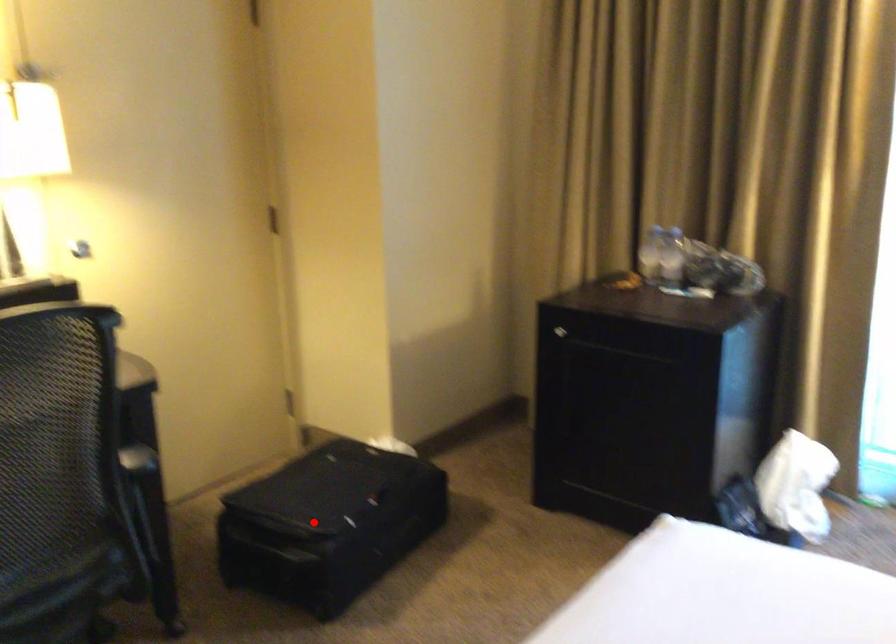
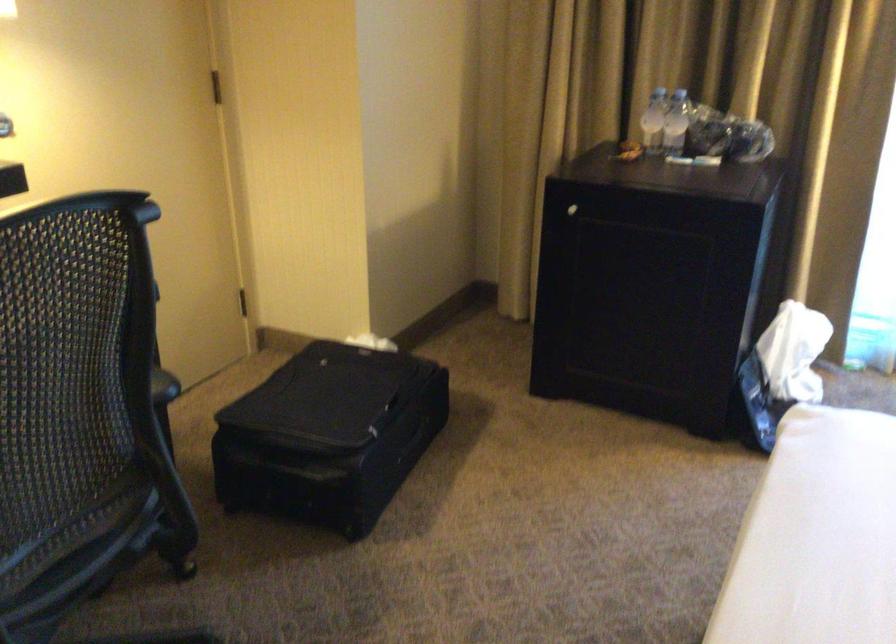
Find the pixel in the second image that matches the highlighted location in the first image.

(329, 436)